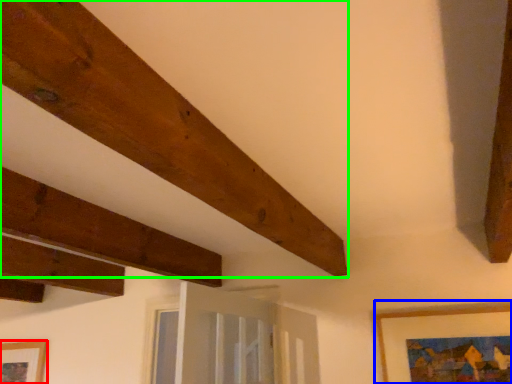
Question: Estimate the real-world distances between objects in this image. Which object is closer to picture frame (highlighted by a red box), picture frame (highlighted by a blue box) or plank (highlighted by a green box)?

Choices:
 (A) picture frame
 (B) plank

Answer: (B)